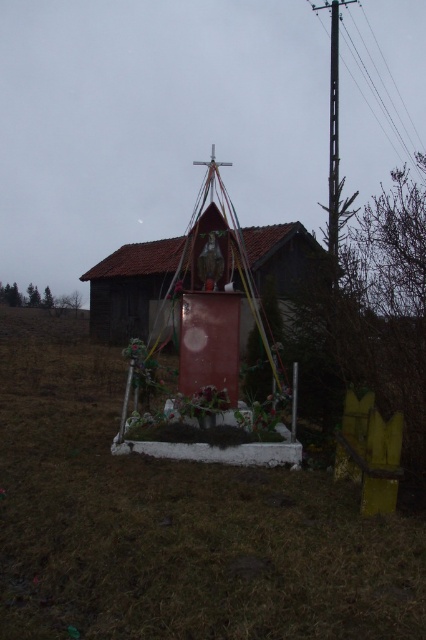
You are standing at the point marked by the coordinates point (129,289) in the image. Looking around, you see the red pedestal structure and the house in the background. Which direction should you face to see the red pedestal structure?

You should face towards the foreground direction because the red pedestal structure is located in the foreground, while the smooth wooden hut at center represented by point (129,289) is in the center of the image.

You are a photographer trying to capture the smooth wooden hut at center and the metallic pole at upper right in the same frame. Based on their heights, which object will appear taller in your photo?

The metallic pole at upper right appears taller in the photo because it is taller than the smooth wooden hut at center.